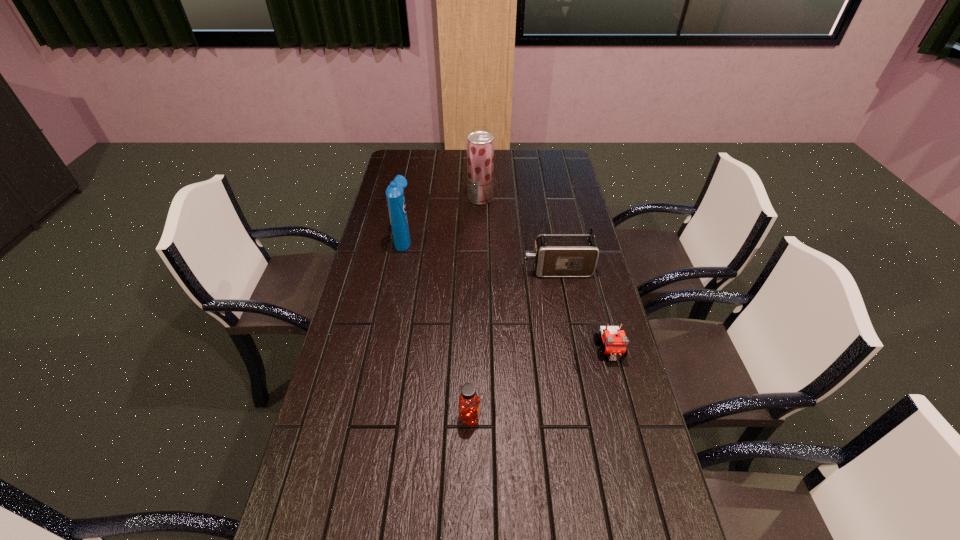
Where is `blank region between the third nearest object and the fruit juice`? blank region between the third nearest object and the fruit juice is located at coordinates (519, 234).

This screenshot has width=960, height=540. What are the coordinates of `free space between the shampoo and the third farthest object` in the screenshot? It's located at (481, 254).

Select which object is the fourth closest to the shortest object. Please provide its 2D coordinates. Your answer should be formatted as a tuple, i.e. [(x, y)], where the tuple contains the x and y coordinates of a point satisfying the conditions above.

[(480, 144)]

You are a GUI agent. You are given a task and a screenshot of the screen. Output one action in this format:
    pyautogui.click(x=<x>, y=<y>)
    Task: Click on the object that is the closest to the nearest object
    
    Given the screenshot: What is the action you would take?
    pyautogui.click(x=615, y=341)